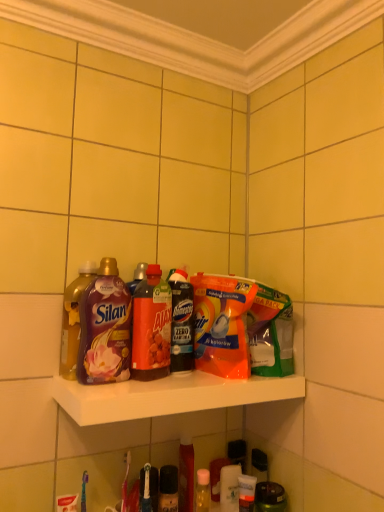
I want to click on vacant space in front of matte plastic bottle at left, arranged as the 2th bottle when viewed from the left, so click(x=99, y=389).